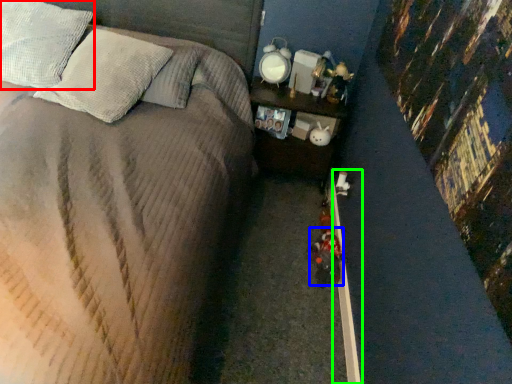
Question: Based on their relative distances, which object is nearer to pillow (highlighted by a red box)? Choose from toy (highlighted by a blue box) and curb (highlighted by a green box).

Choices:
 (A) toy
 (B) curb

Answer: (B)